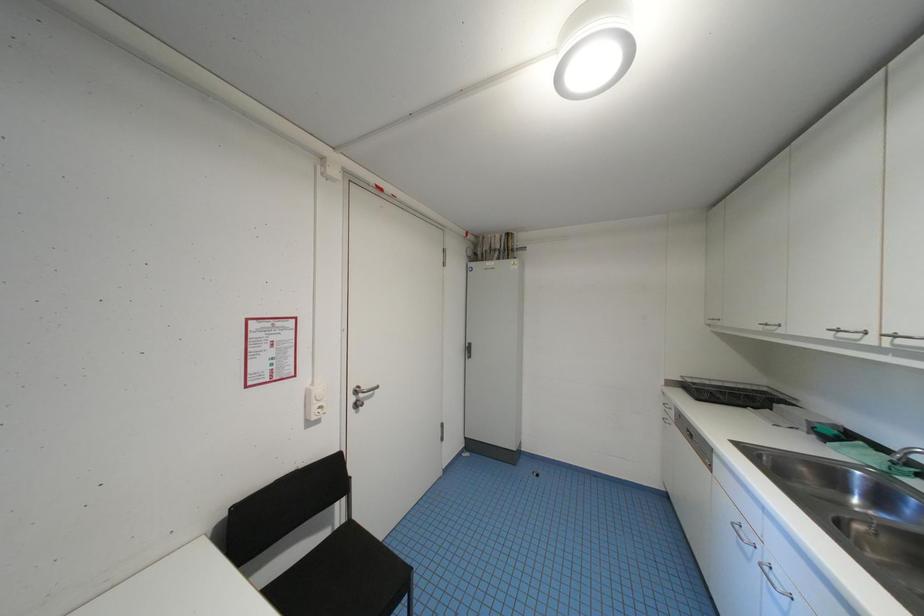
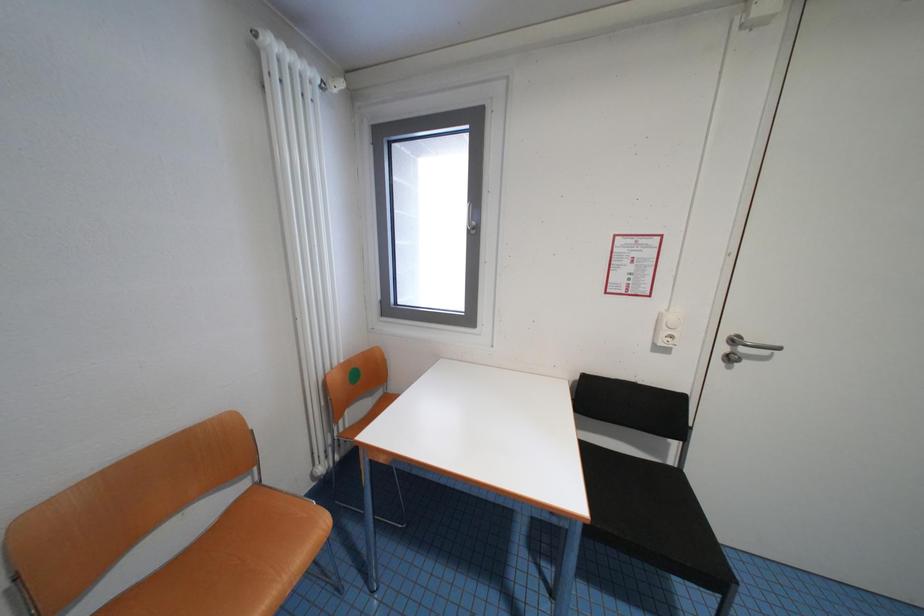
Question: How did the camera likely rotate?

Choices:
 (A) Left
 (B) Right
 (C) Up
 (D) Down

Answer: (A)